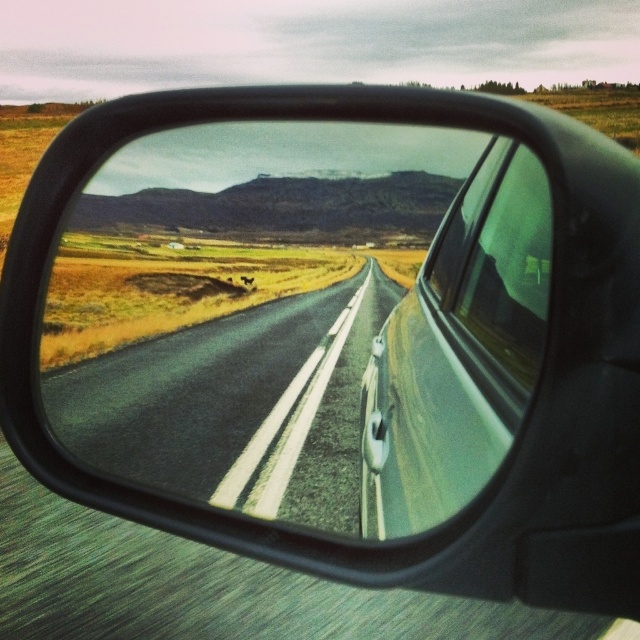
Question: Considering the real-world distances, which object is closest to the asphalt road at center?

Choices:
 (A) transparent glass car window at center
 (B) black glossy mirror at center

Answer: (A)

Question: Does asphalt road at center appear over transparent glass car window at center?

Choices:
 (A) no
 (B) yes

Answer: (A)

Question: Among these objects, which one is nearest to the camera?

Choices:
 (A) asphalt road at center
 (B) transparent glass car window at center
 (C) black glossy mirror at center

Answer: (B)

Question: Which object is positioned closest to the transparent glass car window at center?

Choices:
 (A) black glossy mirror at center
 (B) asphalt road at center

Answer: (B)

Question: From the image, what is the correct spatial relationship of black glossy mirror at center in relation to asphalt road at center?

Choices:
 (A) right
 (B) left

Answer: (B)

Question: Does black glossy mirror at center appear under asphalt road at center?

Choices:
 (A) yes
 (B) no

Answer: (B)